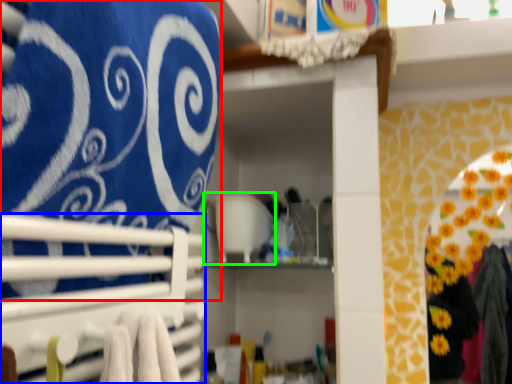
Question: Which object is positioned closest to bath towel (highlighted by a red box)? Select from closet (highlighted by a blue box) and appliance (highlighted by a green box).

Choices:
 (A) closet
 (B) appliance

Answer: (A)